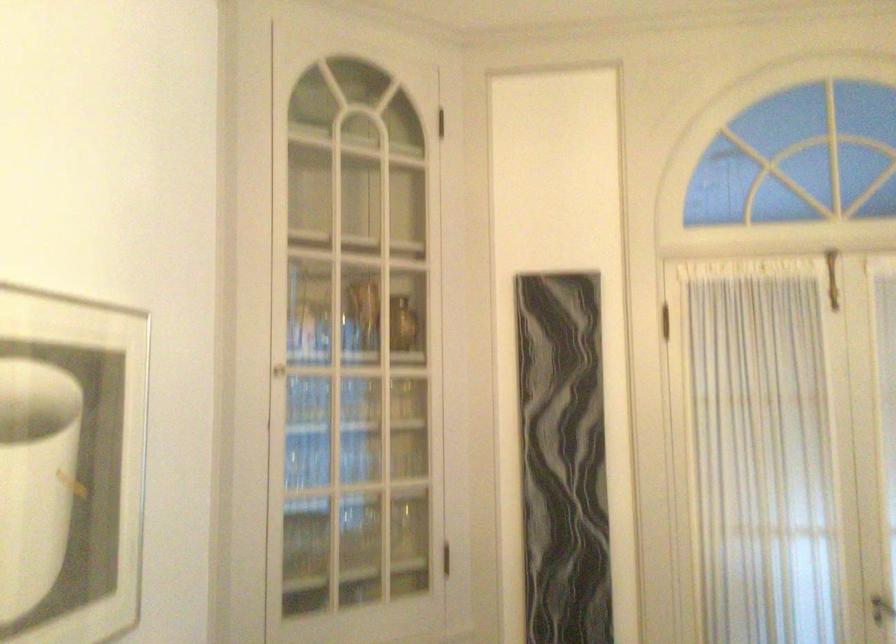
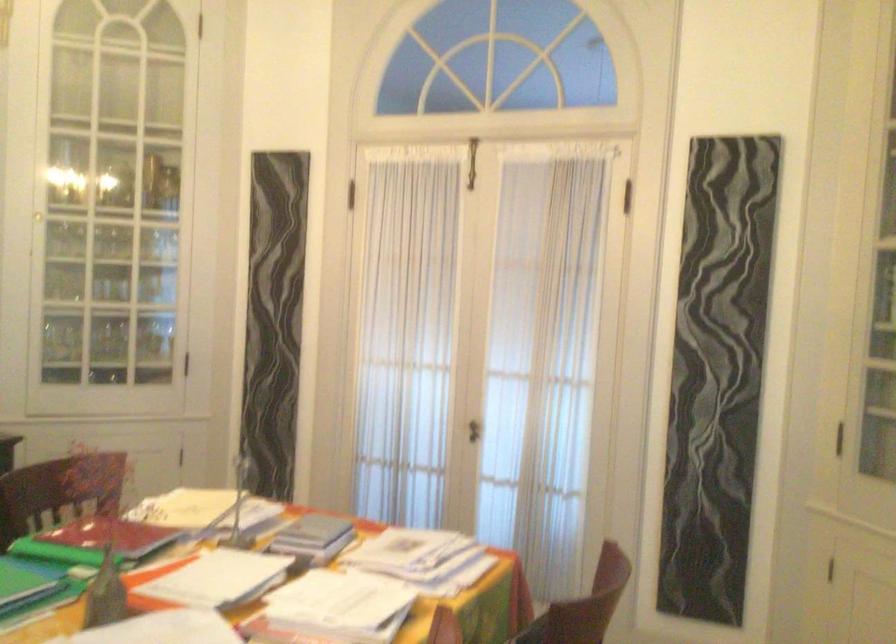
Question: What movement of the cameraman would produce the second image?

Choices:
 (A) Left
 (B) Right
 (C) Forward
 (D) Backward

Answer: (B)